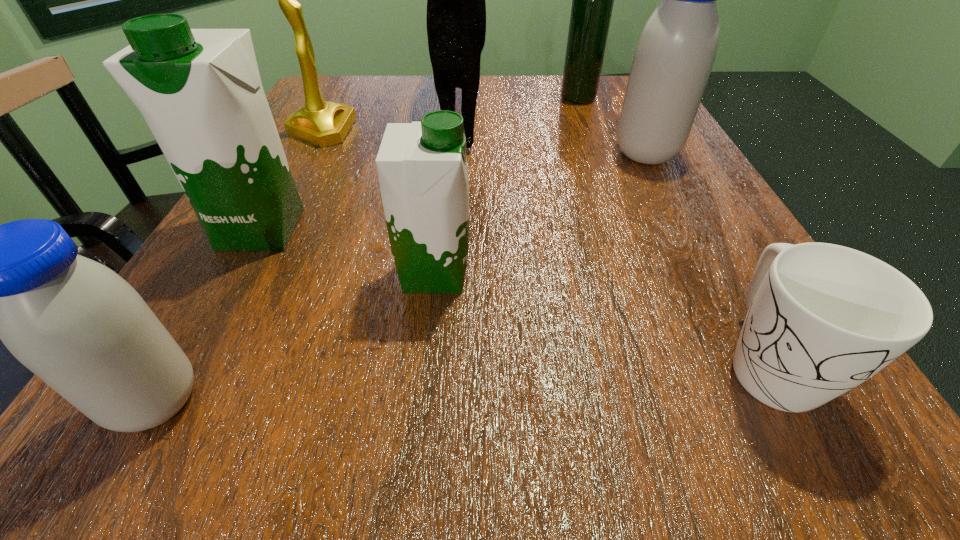
This screenshot has height=540, width=960. In order to click on award that is at the far edge in this screenshot , I will do `click(321, 123)`.

The width and height of the screenshot is (960, 540). Find the location of `soya milk located in the near edge section of the desktop`. soya milk located in the near edge section of the desktop is located at coordinates (81, 328).

What are the coordinates of `mug located at the near edge` in the screenshot? It's located at (822, 318).

You are a GUI agent. You are given a task and a screenshot of the screen. Output one action in this format:
    pyautogui.click(x=<x>, y=<y>)
    Task: Click on the award at the left edge
    The width and height of the screenshot is (960, 540).
    Given the screenshot: What is the action you would take?
    pyautogui.click(x=321, y=123)

The image size is (960, 540). In order to click on liquor that is at the right edge in this screenshot , I will do `click(592, 0)`.

I want to click on soya milk that is at the right edge, so click(x=673, y=59).

I want to click on mug that is at the right edge, so click(x=822, y=318).

You are a GUI agent. You are given a task and a screenshot of the screen. Output one action in this format:
    pyautogui.click(x=<x>, y=<y>)
    Task: Click on the object that is at the far left corner
    
    Given the screenshot: What is the action you would take?
    pyautogui.click(x=321, y=123)

At what (x,y) coordinates should I click in order to perform the action: click on object that is at the near left corner. Please return your answer as a coordinate pair (x, y). Looking at the image, I should click on (81, 328).

At what (x,y) coordinates should I click in order to perform the action: click on object that is at the far right corner. Please return your answer as a coordinate pair (x, y). Image resolution: width=960 pixels, height=540 pixels. Looking at the image, I should click on click(x=592, y=0).